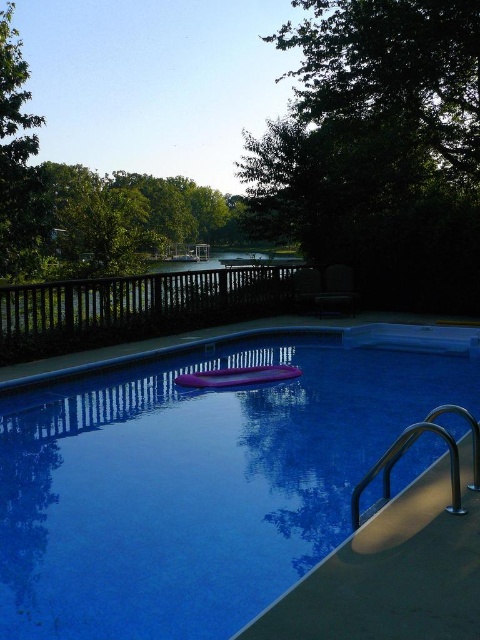
Does glossy plastic pool at center appear under green leafy tree at upper right?

Correct, glossy plastic pool at center is located below green leafy tree at upper right.

The height and width of the screenshot is (640, 480). What do you see at coordinates (202, 480) in the screenshot? I see `glossy plastic pool at center` at bounding box center [202, 480].

The height and width of the screenshot is (640, 480). Identify the location of glossy plastic pool at center. (202, 480).

Can you confirm if glossy plastic pool at center is bigger than satin silver rail at lower right?

No.

Can you confirm if glossy plastic pool at center is shorter than satin silver rail at lower right?

Correct, glossy plastic pool at center is not as tall as satin silver rail at lower right.

The height and width of the screenshot is (640, 480). What do you see at coordinates (202, 480) in the screenshot? I see `glossy plastic pool at center` at bounding box center [202, 480].

Identify the location of glossy plastic pool at center. (202, 480).

Which is above, metallic silver handrail at lower right or brown wooden rail at upper center?

brown wooden rail at upper center

Where is `metallic silver handrail at lower right`? The image size is (480, 640). metallic silver handrail at lower right is located at coordinates (395, 563).